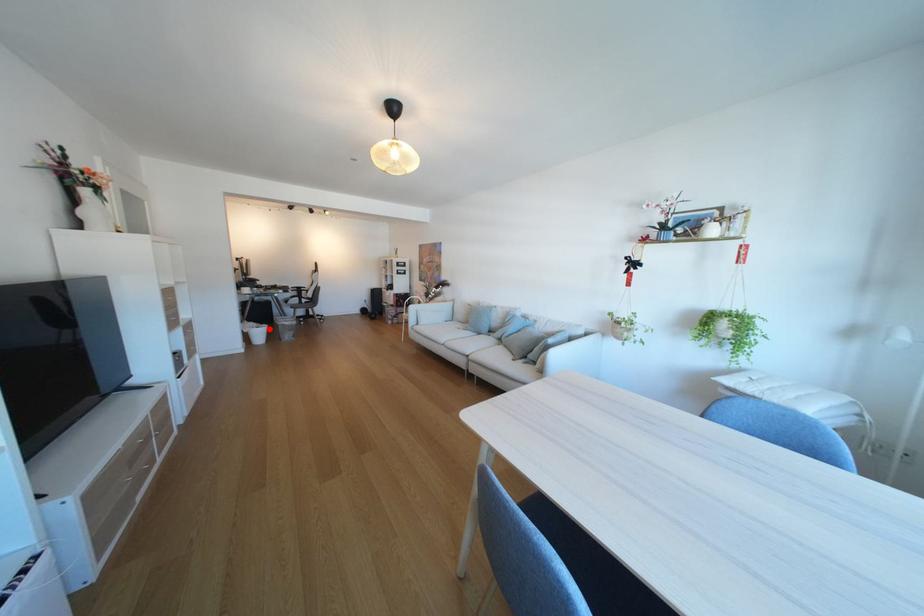
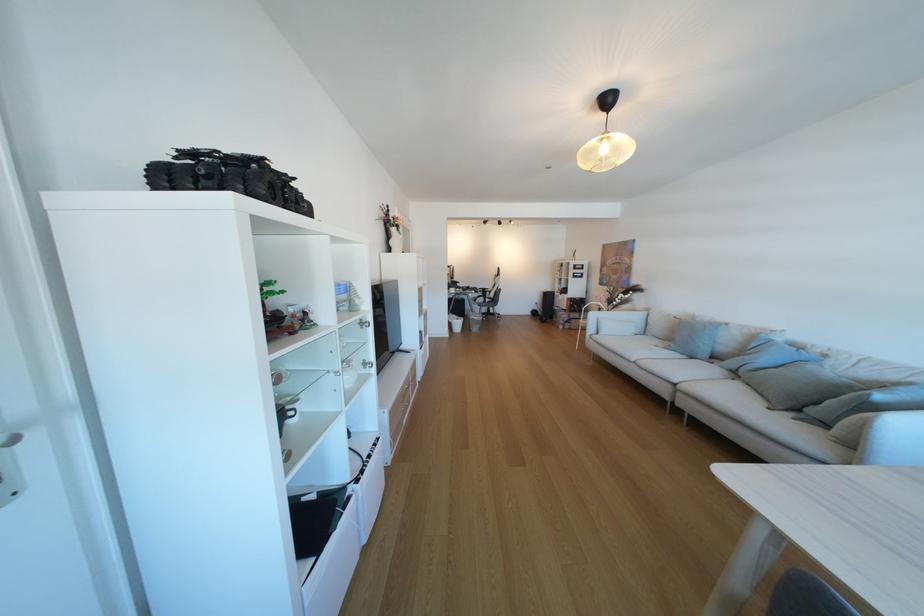
Question: I am providing you with two images of the same scene from different viewpoints. Image1 has a red point marked. In image2, the corresponding 3D location appears at what relative position? Reply with the corresponding letter.

Choices:
 (A) Closer
 (B) Farther

Answer: (B)